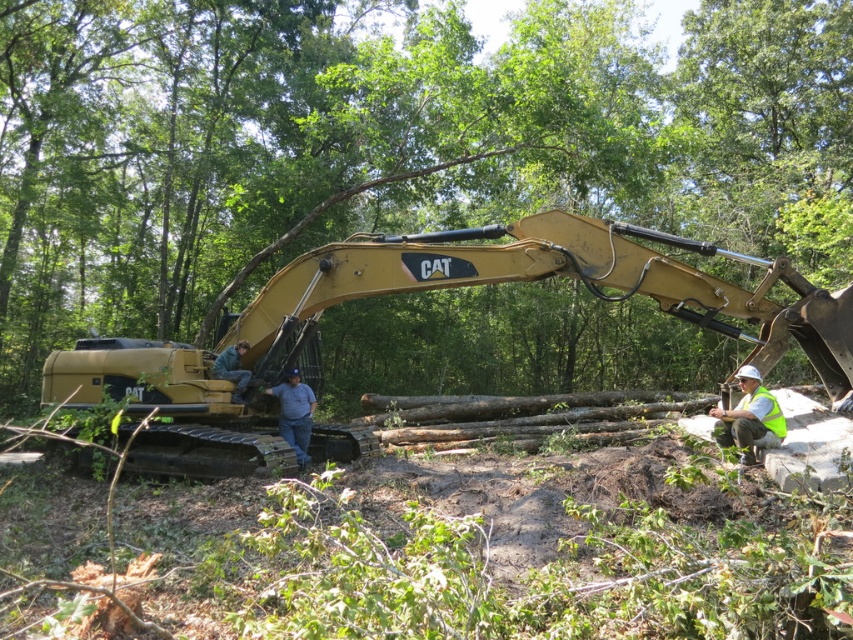
Which is more to the left, matte yellow excavator at center or blue jeans at center?

blue jeans at center

Between point (233, 326) and point (242, 349), which one is positioned behind?

The point (233, 326) is behind.

Identify the location of matte yellow excavator at center. (537, 280).

Between smooth brown log at center and blue jeans at center, which one appears on the left side from the viewer's perspective?

From the viewer's perspective, blue jeans at center appears more on the left side.

Does smooth brown log at center appear over blue jeans at center?

Yes.

Describe the element at coordinates (387, 144) in the screenshot. The width and height of the screenshot is (853, 640). I see `smooth brown log at center` at that location.

Where is `smooth brown log at center`? Image resolution: width=853 pixels, height=640 pixels. smooth brown log at center is located at coordinates (387, 144).

Does smooth brown log at center have a greater height compared to yellow reflective vest at lower right?

Correct, smooth brown log at center is much taller as yellow reflective vest at lower right.

Can you confirm if smooth brown log at center is smaller than yellow reflective vest at lower right?

Incorrect, smooth brown log at center is not smaller in size than yellow reflective vest at lower right.

Who is more distant from viewer, (682, 115) or (762, 422)?

The point (682, 115) is behind.

This screenshot has height=640, width=853. I want to click on smooth brown log at center, so click(x=387, y=144).